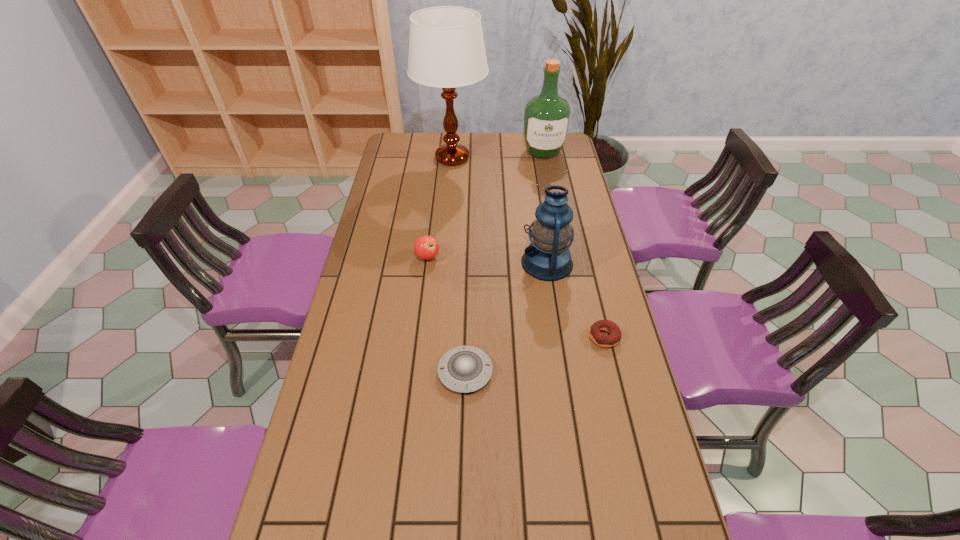
Find the location of `vacant region located on the face of the fourth shortest object`. vacant region located on the face of the fourth shortest object is located at coordinates (413, 263).

The height and width of the screenshot is (540, 960). What are the coordinates of `vacant space located on the back of the apple` in the screenshot? It's located at pyautogui.click(x=432, y=222).

Find the location of `free space located on the front of the saucer`. free space located on the front of the saucer is located at coordinates (464, 414).

Identify the location of vacant space located on the left of the doughnut. (480, 337).

Locate an element on the screen. table lamp at the far edge is located at coordinates (446, 46).

Where is `liquor situated at the far edge`? Image resolution: width=960 pixels, height=540 pixels. liquor situated at the far edge is located at coordinates (546, 116).

Identify the location of object that is at the left edge. (446, 46).

Identify the location of liquor that is at the right edge. point(546,116).

At what (x,y) coordinates should I click in order to perform the action: click on lantern that is at the right edge. Please return your answer as a coordinate pair (x, y). This screenshot has width=960, height=540. Looking at the image, I should click on (547, 258).

Image resolution: width=960 pixels, height=540 pixels. Identify the location of doughnut that is at the right edge. (614, 338).